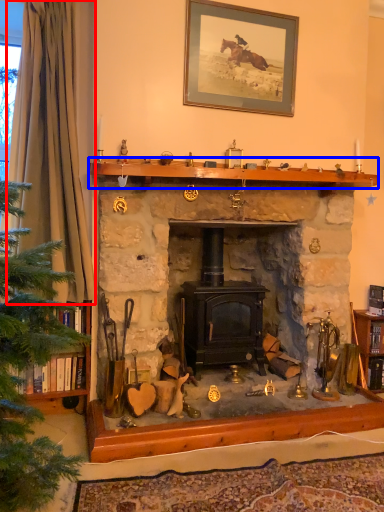
Question: Among these objects, which one is farthest to the camera, curtain (highlighted by a red box) or mantle (highlighted by a blue box)?

Choices:
 (A) curtain
 (B) mantle

Answer: (B)